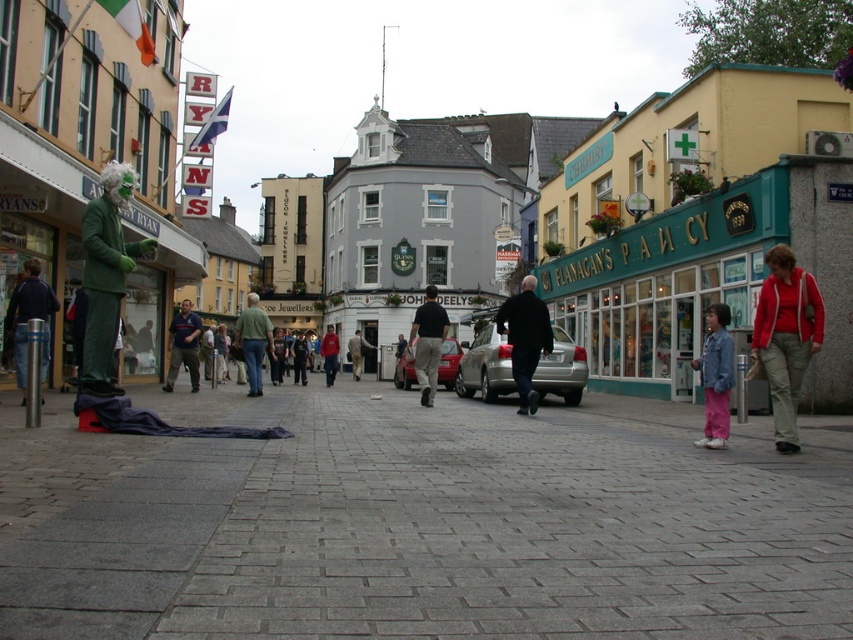
You are a customer looking for a jacket to wear during a rainy day. You see the red cotton jacket at lower right and the dark blue shirt at center. Which item is shorter in height?

The red cotton jacket at lower right has a lesser height compared to the dark blue shirt at center, so the red cotton jacket at lower right is shorter in height.

You are a tourist walking down the street and want to take a photo of both the gray stone pavement at center and the dark blue jacket at center. Since you want both items to be clearly visible in the photo, which one should you focus on to ensure it doesn

The gray stone pavement at center is bigger than the dark blue jacket at center, so focusing on the gray stone pavement at center will ensure both are visible as it takes up more space in the frame.